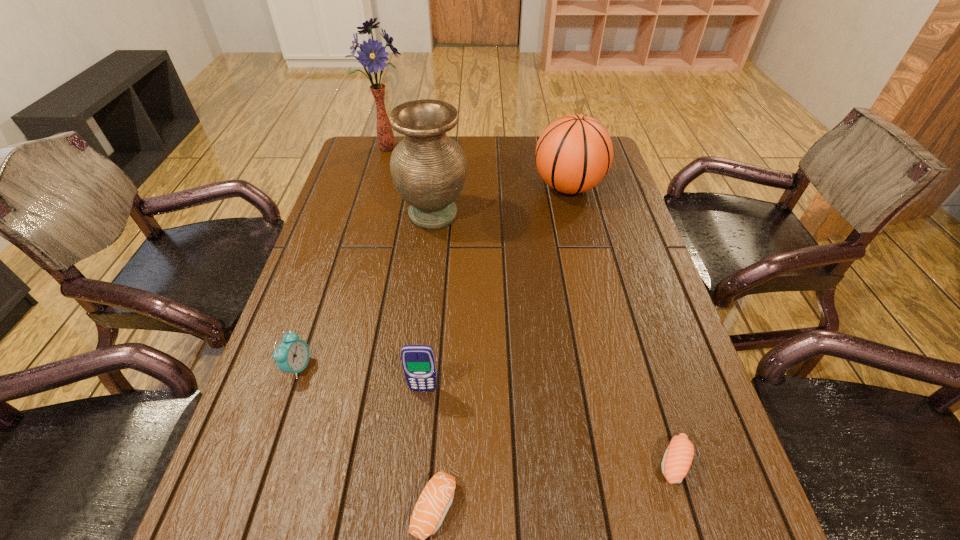
Where is `vacant space that is in between the alarm clock and the vase`? The height and width of the screenshot is (540, 960). vacant space that is in between the alarm clock and the vase is located at coordinates (366, 291).

Locate an element on the screen. Image resolution: width=960 pixels, height=540 pixels. vacant area between the fourth tallest object and the third tallest object is located at coordinates (495, 288).

Locate an element on the screen. The width and height of the screenshot is (960, 540). vacant area that lies between the fourth farthest object and the second tallest object is located at coordinates (366, 291).

Locate an element on the screen. Image resolution: width=960 pixels, height=540 pixels. free space that is in between the third shortest object and the right sushi is located at coordinates (486, 414).

At what (x,y) coordinates should I click in order to perform the action: click on object that stands as the closest to the fourth shortest object. Please return your answer as a coordinate pair (x, y). The height and width of the screenshot is (540, 960). Looking at the image, I should click on (436, 498).

I want to click on object that stands as the closest to the right sushi, so click(436, 498).

In order to click on blank space that satisfies the following two spatial constraints: 1. on the front side of the right sushi; 2. on the right side of the tallest object in this screenshot , I will do `click(297, 462)`.

Where is `vacant area in the image that satisfies the following two spatial constraints: 1. on the front side of the right sushi; 2. on the left side of the vase`? Image resolution: width=960 pixels, height=540 pixels. vacant area in the image that satisfies the following two spatial constraints: 1. on the front side of the right sushi; 2. on the left side of the vase is located at coordinates tap(404, 462).

At what (x,y) coordinates should I click in order to perform the action: click on vacant space that satisfies the following two spatial constraints: 1. on the front side of the farthest object; 2. on the face of the alarm clock. Please return your answer as a coordinate pair (x, y). Looking at the image, I should click on (324, 367).

Find the location of a particular element. The image size is (960, 540). free space that satisfies the following two spatial constraints: 1. on the front-facing side of the right sushi; 2. on the left side of the fourth shortest object is located at coordinates (416, 462).